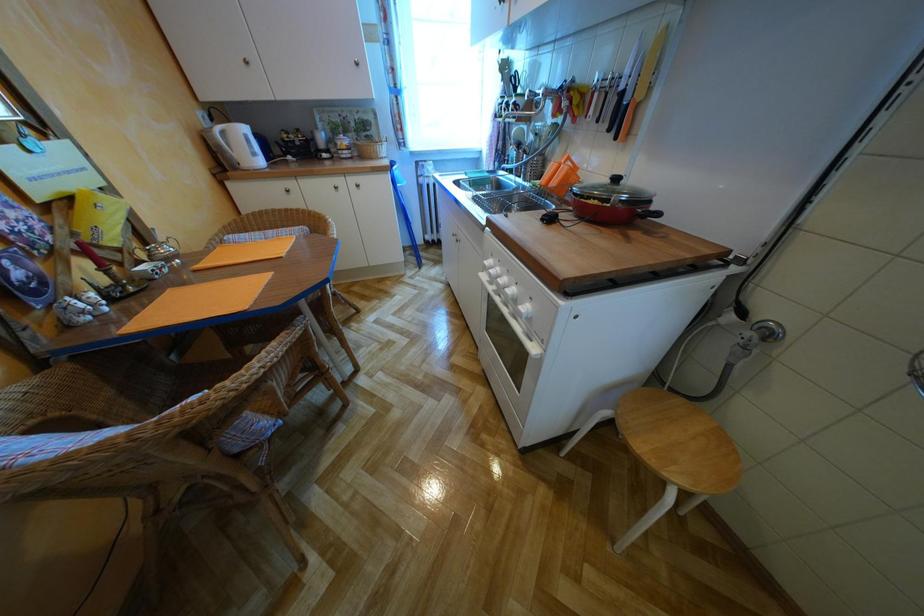
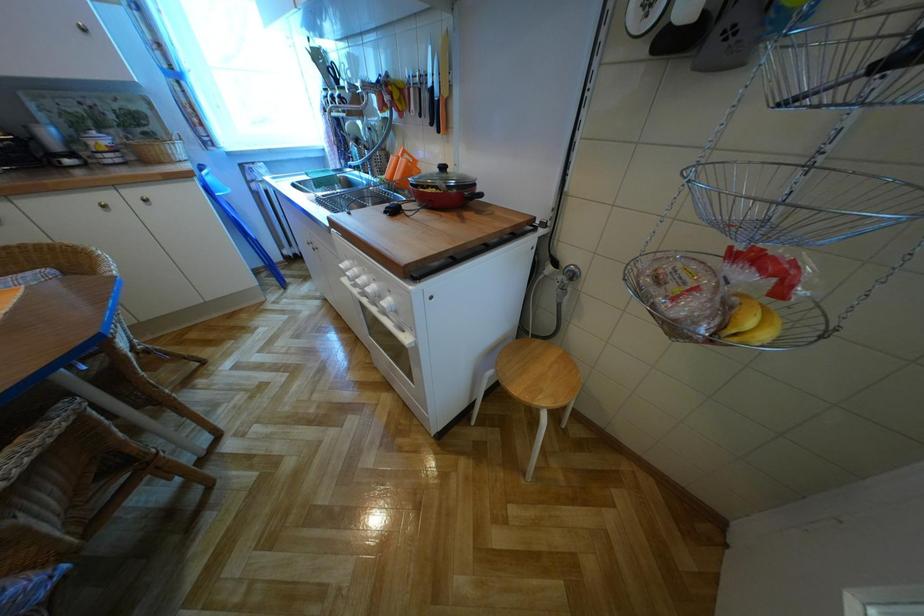
Question: The first image is from the beginning of the video and the second image is from the end. How did the camera likely rotate when shooting the video?

Choices:
 (A) Left
 (B) Right
 (C) Up
 (D) Down

Answer: (B)